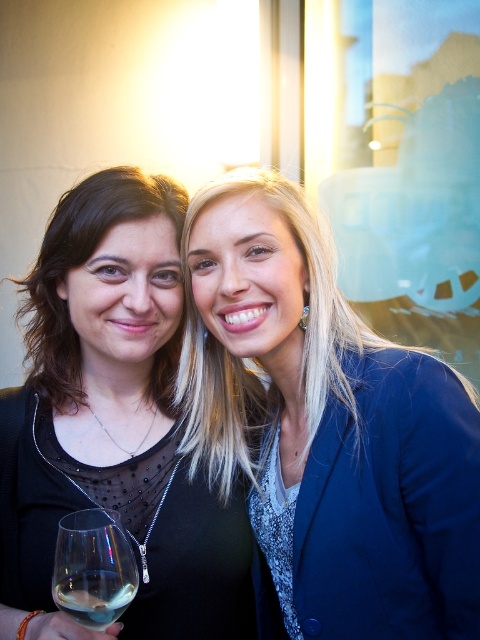
Between blue satin blazer at upper right and clear glass wine at lower left, which one is positioned higher?

blue satin blazer at upper right

Can you confirm if blue satin blazer at upper right is wider than clear glass wine at lower left?

Yes.

Who is more forward, (301, 552) or (88, 595)?

Positioned in front is point (88, 595).

Find the location of a particular element. The height and width of the screenshot is (640, 480). blue satin blazer at upper right is located at coordinates (330, 429).

Describe the element at coordinates (330, 429) in the screenshot. This screenshot has height=640, width=480. I see `blue satin blazer at upper right` at that location.

The image size is (480, 640). What are the coordinates of `blue satin blazer at upper right` in the screenshot? It's located at (330, 429).

Describe the element at coordinates (330, 429) in the screenshot. Image resolution: width=480 pixels, height=640 pixels. I see `blue satin blazer at upper right` at that location.

In order to click on blue satin blazer at upper right in this screenshot , I will do `click(330, 429)`.

Between black matte dress at center and clear glass wine glass at lower left, which one is positioned lower?

Positioned lower is clear glass wine glass at lower left.

Looking at this image, can you confirm if black matte dress at center is positioned to the left of clear glass wine glass at lower left?

Yes, black matte dress at center is to the left of clear glass wine glass at lower left.

Identify the location of black matte dress at center. (116, 420).

Locate an element on the screen. black matte dress at center is located at coordinates (116, 420).